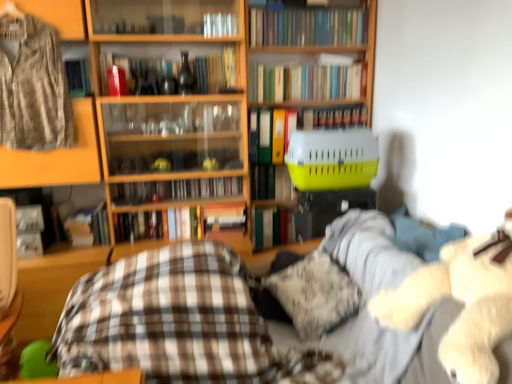
Measure the distance between camouflage fabric shirt at left and camera.

The depth of camouflage fabric shirt at left is 2.07 meters.

What do you see at coordinates (306, 82) in the screenshot? I see `hardcover books at upper center, which is the ninth book from bottom to top` at bounding box center [306, 82].

What do you see at coordinates (334, 117) in the screenshot? Image resolution: width=512 pixels, height=384 pixels. I see `hardcover book at center, which is the 3th book in top-to-bottom order` at bounding box center [334, 117].

This screenshot has width=512, height=384. I want to click on plaid fabric at center, so click(167, 319).

In order to face hardcover books at upper center, which ranks as the tenth book in bottom-to-top order, should I rotate leftwards or rightwards?

You should look right and rotate roughly 7.064 degrees.

Describe the element at coordinates (318, 76) in the screenshot. The height and width of the screenshot is (384, 512). I see `yellow plastic pet carrier at center` at that location.

Where is `yellow plastic pet carrier at center`? The image size is (512, 384). yellow plastic pet carrier at center is located at coordinates (318, 76).

Where is `camouflage fabric shirt at left`? camouflage fabric shirt at left is located at coordinates (33, 87).

From the image's perspective, between green matte file folder at center, which is the fourth book from top to bottom, and plaid fabric at center, who is located below?

plaid fabric at center is shown below in the image.

Is point (269, 119) closer to viewer compared to point (164, 292)?

No, (269, 119) is further to viewer.

From a real-world perspective, relative to plaid fabric at center, is green matte file folder at center, positioned as the seventh book in bottom-to-top order, vertically above or below?

From a real-world perspective, green matte file folder at center, positioned as the seventh book in bottom-to-top order, is physically above plaid fabric at center.

How distant is green matte file folder at center, positioned as the seventh book in bottom-to-top order, from plaid fabric at center?

They are 1.22 meters apart.

Would you consider hardcover book at center, which is the 8th book from bottom to top, to be distant from hardcover books at upper center, acting as the 2th book starting from the top?

hardcover book at center, which is the 8th book from bottom to top, is near hardcover books at upper center, acting as the 2th book starting from the top, not far away.

Is hardcover book at center, which is the 3th book in top-to-bottom order, positioned with its back to hardcover books at upper center, acting as the 2th book starting from the top?

No, hardcover book at center, which is the 3th book in top-to-bottom order, is not facing away from hardcover books at upper center, acting as the 2th book starting from the top.

From the picture: From the image's perspective, which is below, hardcover book at center, which is the 3th book in top-to-bottom order, or hardcover books at upper center, which is the ninth book from bottom to top?

From the image's view, hardcover book at center, which is the 3th book in top-to-bottom order, is below.

How many degrees apart are the facing directions of hardcover book at center, which is the 3th book in top-to-bottom order, and hardcover books at upper center, which is the ninth book from bottom to top?

0.39 degrees.

Would you say hardcover books at center, which is the 8th book from top to bottom, is a long distance from hardcover book at center, which is counted as the 1th book, starting from the bottom?

Actually, hardcover books at center, which is the 8th book from top to bottom, and hardcover book at center, which is counted as the 1th book, starting from the bottom, are a little close together.

Considering the relative positions of hardcover books at center, which is the 8th book from top to bottom, and hardcover book at center, which is counted as the 1th book, starting from the bottom, in the image provided, is hardcover books at center, which is the 8th book from top to bottom, to the left of hardcover book at center, which is counted as the 1th book, starting from the bottom, from the viewer's perspective?

In fact, hardcover books at center, which is the 8th book from top to bottom, is to the right of hardcover book at center, which is counted as the 1th book, starting from the bottom.

Which of these two, hardcover books at center, placed as the 3th book when sorted from bottom to top, or hardcover book at center, acting as the 10th book starting from the top, is smaller?

Smaller between the two is hardcover book at center, acting as the 10th book starting from the top.

Which object is further away from the camera, hardcover books at center, which is the 8th book from top to bottom, or hardcover book at center, acting as the 10th book starting from the top?

hardcover book at center, acting as the 10th book starting from the top, is further from the camera.

Could yellow plastic pet carrier at center be considered to be inside green matte file folder at center, positioned as the seventh book in bottom-to-top order?

That's incorrect, yellow plastic pet carrier at center is not inside green matte file folder at center, positioned as the seventh book in bottom-to-top order.

Which of these two, green matte file folder at center, positioned as the seventh book in bottom-to-top order, or yellow plastic pet carrier at center, is wider?

yellow plastic pet carrier at center.

What's the angular difference between green matte file folder at center, positioned as the seventh book in bottom-to-top order, and yellow plastic pet carrier at center's facing directions?

1.35 degrees separate the facing orientations of green matte file folder at center, positioned as the seventh book in bottom-to-top order, and yellow plastic pet carrier at center.

Does point (358, 148) appear closer or farther from the camera than point (74, 351)?

Point (358, 148) is positioned farther from the camera compared to point (74, 351).

Is yellow plastic pet carrier at center oriented towards plaid fabric at center?

No, yellow plastic pet carrier at center is not aimed at plaid fabric at center.

Is yellow plastic pet carrier at center bigger than plaid fabric at center?

Incorrect, yellow plastic pet carrier at center is not larger than plaid fabric at center.

From the image's perspective, would you say yellow plastic pet carrier at center is shown under plaid fabric at center?

No, from the image's perspective, yellow plastic pet carrier at center is not beneath plaid fabric at center.

From the image's perspective, is yellow plastic pet carrier at center below camouflage fabric shirt at left?

Indeed, from the image's perspective, yellow plastic pet carrier at center is shown beneath camouflage fabric shirt at left.

Based on their positions, is yellow plastic pet carrier at center located to the left or right of camouflage fabric shirt at left?

yellow plastic pet carrier at center is to the right of camouflage fabric shirt at left.

Is yellow plastic pet carrier at center positioned behind camouflage fabric shirt at left?

Yes, it is behind camouflage fabric shirt at left.

Is yellow plastic pet carrier at center completely or partially outside of camouflage fabric shirt at left?

Yes, yellow plastic pet carrier at center is located beyond the bounds of camouflage fabric shirt at left.

Which is closer to the camera, (x=103, y=223) or (x=187, y=92)?

Point (x=103, y=223).

From a real-world perspective, is hardcover book at center, acting as the 10th book starting from the top, located higher than matte glass wine bottle at upper center?

Incorrect, from a real-world perspective, hardcover book at center, acting as the 10th book starting from the top, is lower than matte glass wine bottle at upper center.

In terms of width, does hardcover book at center, which is counted as the 1th book, starting from the bottom, look wider or thinner when compared to matte glass wine bottle at upper center?

hardcover book at center, which is counted as the 1th book, starting from the bottom, is wider than matte glass wine bottle at upper center.

Does hardcover book at center, acting as the 10th book starting from the top, lie behind matte glass wine bottle at upper center?

Yes, it is behind matte glass wine bottle at upper center.

Where is `the 7th book above the plaid fabric at center (from a real-world perspective)`? This screenshot has width=512, height=384. the 7th book above the plaid fabric at center (from a real-world perspective) is located at coordinates (275, 134).

Identify the location of the 2nd book to the right of the hardcover books at upper center, acting as the 2th book starting from the top, counting from the anchor's position. (334, 117).

Which object lies nearer to the anchor point wooden bookcase at upper center, hardcover book at center, which is the 3th book in top-to-bottom order, or hardcover books at center, placed as the 3th book when sorted from bottom to top?

Among the two, hardcover books at center, placed as the 3th book when sorted from bottom to top, is located nearer to wooden bookcase at upper center.

Based on their spatial positions, is yellow plastic pet carrier at center or hardcover book at center, which is the 6th book from top to bottom, further from hardcover books at upper center, which ranks as the tenth book in bottom-to-top order?

Based on the image, hardcover book at center, which is the 6th book from top to bottom, appears to be further to hardcover books at upper center, which ranks as the tenth book in bottom-to-top order.

Which object lies nearer to the anchor point hardcover book at center, the 7th book viewed from the top, plaid fabric at center or camouflage fabric shirt at left?

Among the two, camouflage fabric shirt at left is located nearer to hardcover book at center, the 7th book viewed from the top.

From the image, which object appears to be farther from camouflage fabric shirt at left, hardcover book at center, the fifth book in the top-to-bottom sequence, or fluffy white teddy bear at right?

fluffy white teddy bear at right.

When comparing their distances from wooden bookcase at upper center, does hardcover books at upper center, the 1th book viewed from the top, or hardcover book at center, which appears as the 9th book when viewed from the top, seem further?

Based on the image, hardcover book at center, which appears as the 9th book when viewed from the top, appears to be further to wooden bookcase at upper center.

When comparing their distances from fluffy white pillow at center, does hardcover book at center, which appears as the 9th book when viewed from the top, or yellow plastic pet carrier at center seem further?

hardcover book at center, which appears as the 9th book when viewed from the top, is positioned further to the anchor fluffy white pillow at center.

Based on their spatial positions, is hardcover book at center, which appears as the 9th book when viewed from the top, or hardcover books at upper center, the 1th book viewed from the top, closer to hardcover book at center, the 6th book when ordered from bottom to top?

hardcover book at center, which appears as the 9th book when viewed from the top, is closer to hardcover book at center, the 6th book when ordered from bottom to top.

Based on their spatial positions, is hardcover book at center, the fifth book in the top-to-bottom sequence, or hardcover book at center, the 7th book viewed from the top, closer to camouflage fabric shirt at left?

hardcover book at center, the 7th book viewed from the top, is closer to camouflage fabric shirt at left.

Locate an element on the screen. The height and width of the screenshot is (384, 512). basket that lies between hardcover books at upper center, which ranks as the tenth book in bottom-to-top order, and plaid fabric at center from top to bottom is located at coordinates (332, 159).

This screenshot has height=384, width=512. In order to click on pillow between plaid fabric at center and yellow plastic pet carrier at center from left to right in this screenshot , I will do `click(309, 294)`.

Locate an element on the screen. wine bottle between plaid fabric at center and hardcover book at center, which is the 6th book from top to bottom, in the front-back direction is located at coordinates (185, 76).

The width and height of the screenshot is (512, 384). Find the location of `basket that lies between hardcover books at upper center, the 1th book viewed from the top, and hardcover book at center, acting as the 5th book starting from the bottom, from top to bottom`. basket that lies between hardcover books at upper center, the 1th book viewed from the top, and hardcover book at center, acting as the 5th book starting from the bottom, from top to bottom is located at coordinates (332, 159).